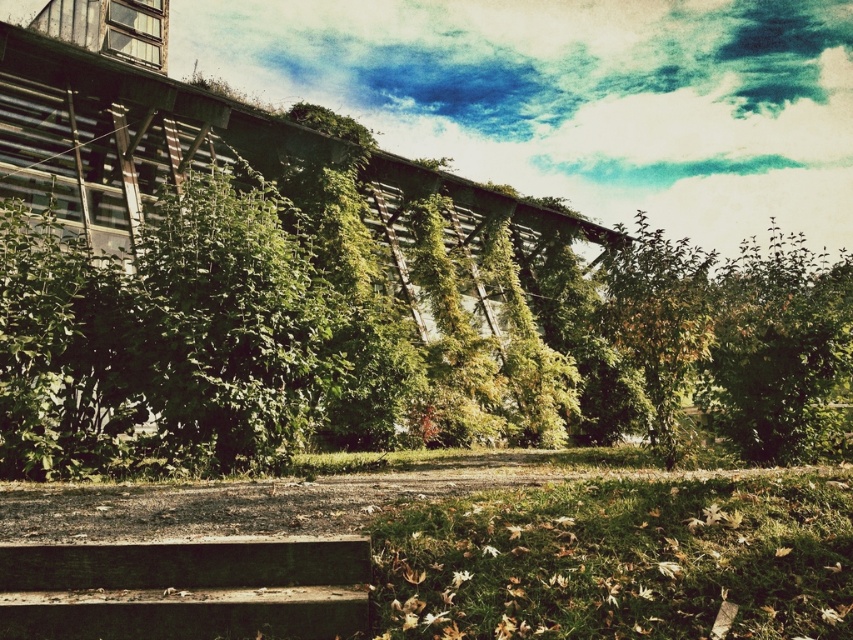
You are a hiker who wants to cross the area near the dark brown wooden stairs at lower center and the green leafy tree at right. Which path would be narrower for your backpack?

The dark brown wooden stairs at lower center has a width less than the green leafy tree at right, so the path near the dark brown wooden stairs at lower center would be narrower for your backpack.

You are a hiker who wants to reach the abandoned building. You see the dark brown wooden stairs at lower center and the green leafy tree at right. Which object is closer to you as you approach the building?

The dark brown wooden stairs at lower center is closer to you because it is in front of the green leafy tree at right.

You are standing at the base of the abandoned structure and want to reach the point closest to you. Which point should you head towards, point (132, 602) or point (801, 456)?

You should head towards point (132, 602) because it is closer to the viewer than point (801, 456).